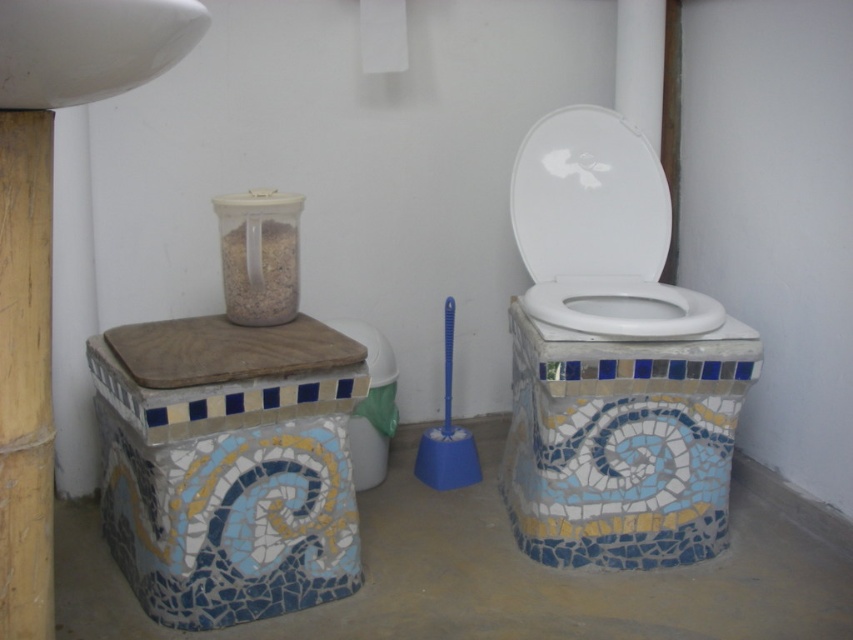
Can you confirm if white glossy toilet lid at center is thinner than mosaic tile toilet bowl at center?

No.

Describe the element at coordinates (589, 198) in the screenshot. I see `white glossy toilet lid at center` at that location.

Between point (569, 248) and point (355, 412), which one is positioned behind?

Positioned behind is point (569, 248).

At what (x,y) coordinates should I click in order to perform the action: click on white glossy toilet lid at center. Please return your answer as a coordinate pair (x, y). Looking at the image, I should click on (589, 198).

Who is higher up, wooden pole at left or white glossy toilet bowl at center?

white glossy toilet bowl at center is above.

Is point (51, 452) positioned behind point (579, 291)?

No, it is in front of (579, 291).

The width and height of the screenshot is (853, 640). I want to click on wooden pole at left, so click(25, 376).

Is point (20, 45) farther from viewer compared to point (386, 440)?

No, (20, 45) is in front of (386, 440).

Can you confirm if white glossy sink at upper left is positioned above mosaic tile toilet bowl at center?

Indeed, white glossy sink at upper left is positioned over mosaic tile toilet bowl at center.

Between point (3, 64) and point (367, 422), which one is positioned behind?

Positioned behind is point (367, 422).

You are a GUI agent. You are given a task and a screenshot of the screen. Output one action in this format:
    pyautogui.click(x=<x>, y=<y>)
    Task: Click on the white glossy sink at upper left
    This screenshot has width=853, height=640.
    Given the screenshot: What is the action you would take?
    pyautogui.click(x=90, y=48)